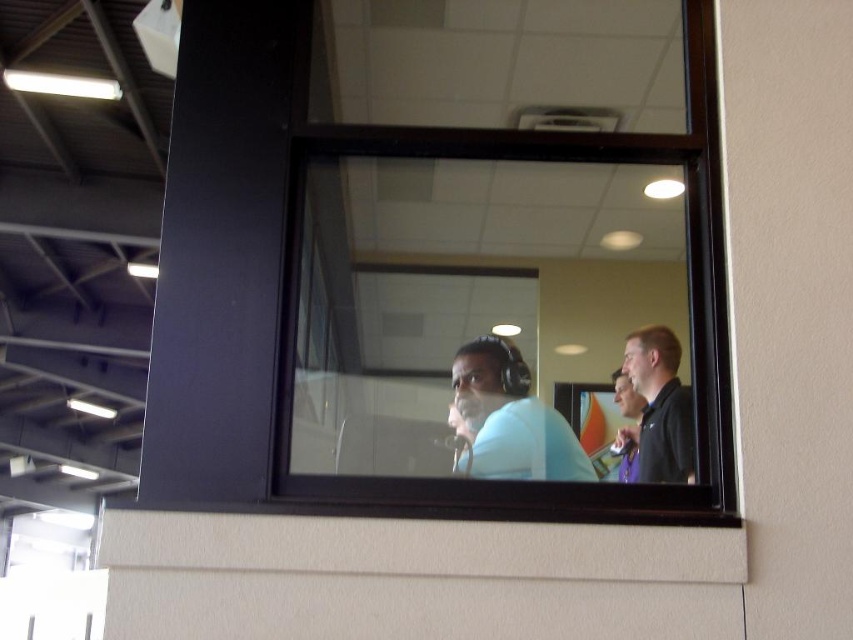
You are an interior designer assessing the lighting in a studio. You notice the transparent glass window at center and the black matte shirt at right. Which object is closer to the left side of the room?

The transparent glass window at center is positioned on the left side of black matte shirt at right, so it is closer to the left side of the room.

You are standing outside the building and looking at the window. You notice two points on the window. The first point is at coordinate point (453, 371) and the second point is at coordinate point (630, 376). From your perspective, which point appears closer to you?

Point (453, 371) is in front of point (630, 376), so it appears closer to you.

You are standing in a room adjacent to the broadcast booth shown in the image. You notice a point marked at coordinates (494, 310). Based on the scene, where is this point located?

The point is located on the transparent glass window at center.